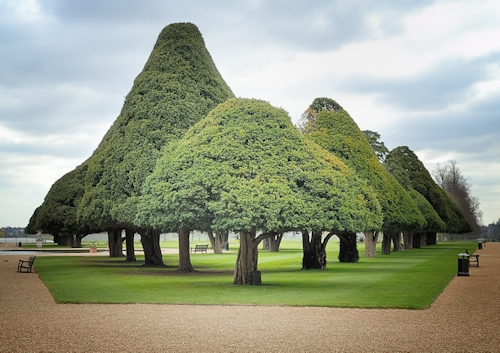
Where is `bench`? The image size is (500, 353). bench is located at coordinates (198, 247).